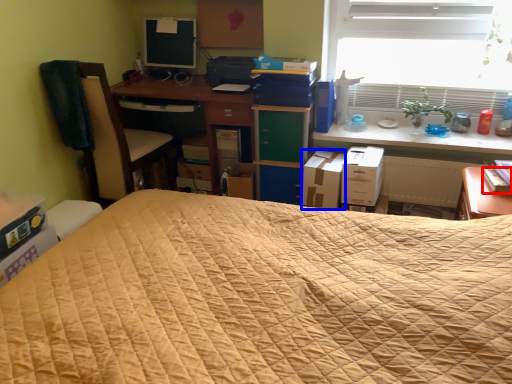
Question: Which of the following is the farthest to the observer, paperback book (highlighted by a red box) or cardboard box (highlighted by a blue box)?

Choices:
 (A) paperback book
 (B) cardboard box

Answer: (B)